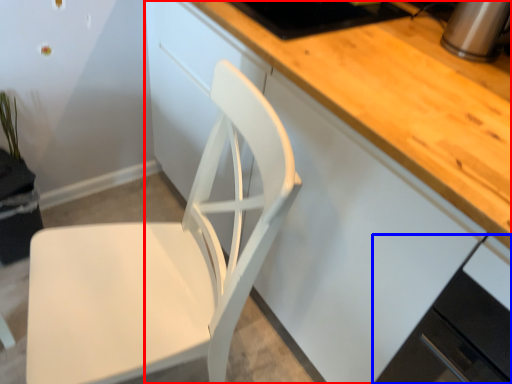
Question: Which point is further to the camera, cabinetry (highlighted by a red box) or cabinetry (highlighted by a blue box)?

Choices:
 (A) cabinetry
 (B) cabinetry

Answer: (A)